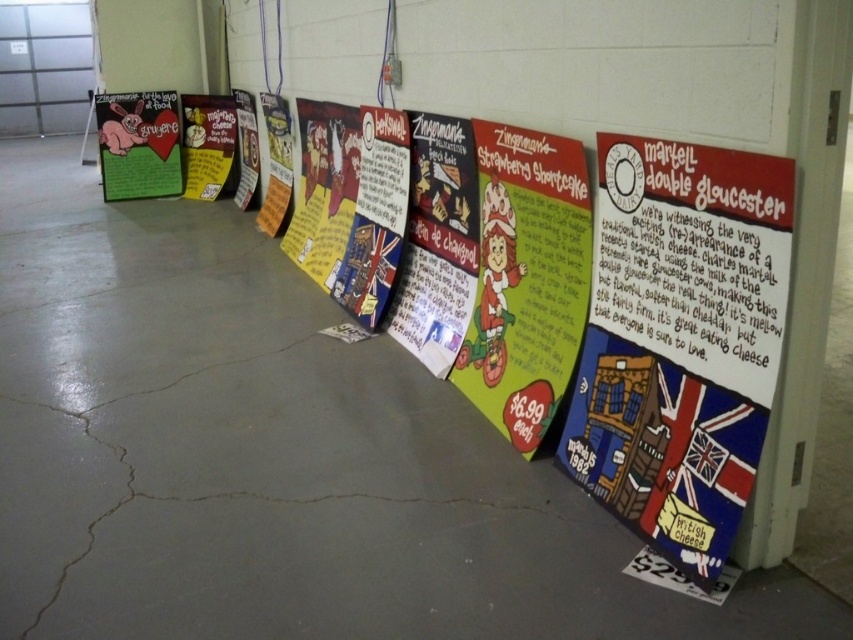
Does matte green poster at center appear on the right side of matte yellow poster at center?

Yes, matte green poster at center is to the right of matte yellow poster at center.

Can you confirm if matte green poster at center is positioned below matte yellow poster at center?

Indeed, matte green poster at center is positioned under matte yellow poster at center.

Describe the element at coordinates (526, 278) in the screenshot. I see `matte green poster at center` at that location.

Where is `matte green poster at center`? matte green poster at center is located at coordinates (526, 278).

In the scene shown: Which of these two, matte green poster at upper left or matte yellow poster at center, stands taller?

With more height is matte green poster at upper left.

Measure the distance from matte green poster at upper left to matte yellow poster at center.

matte green poster at upper left is 16.90 inches from matte yellow poster at center.

Which is in front, point (129, 125) or point (187, 147)?

Positioned in front is point (129, 125).

Find the location of a particular element. matte green poster at upper left is located at coordinates (138, 145).

Measure the distance between matte red poster at center right and camera.

The distance of matte red poster at center right from camera is 1.62 meters.

Locate an element on the screen. matte red poster at center right is located at coordinates 680,340.